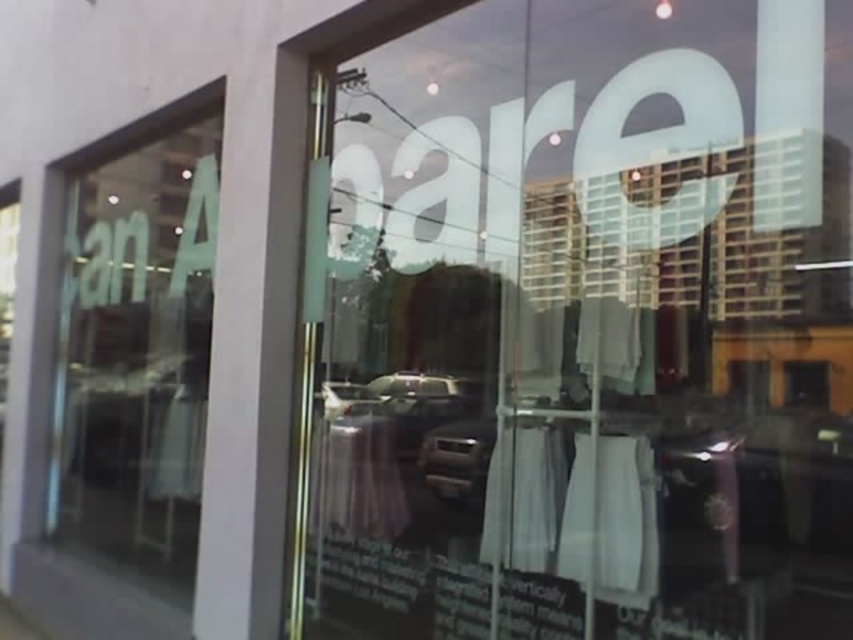
You are standing outside the clothing store and want to see both the transparent glass display at center and the transparent glass window at upper left. Which one appears closer to you?

The transparent glass display at center appears closer to you because it is further to the viewer than the transparent glass window at upper left.